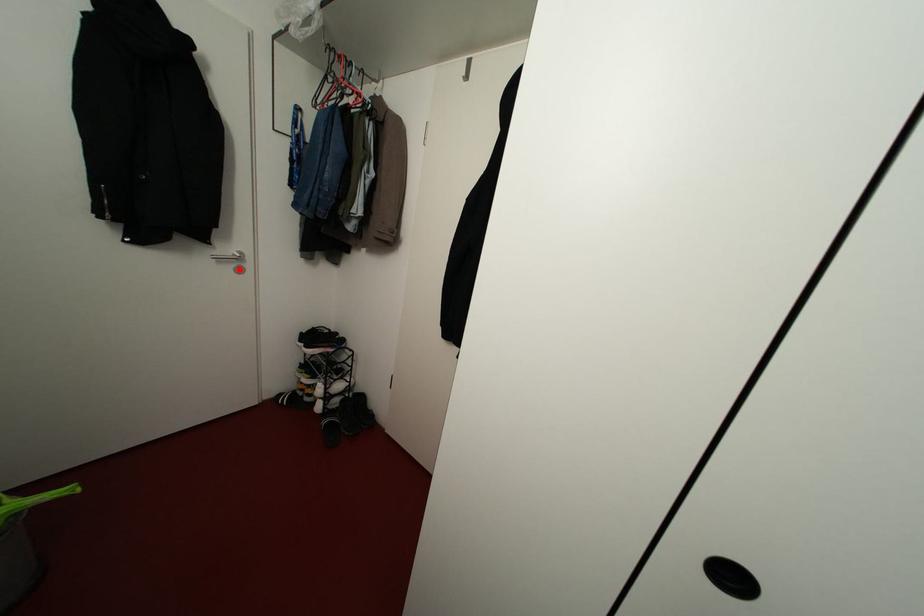
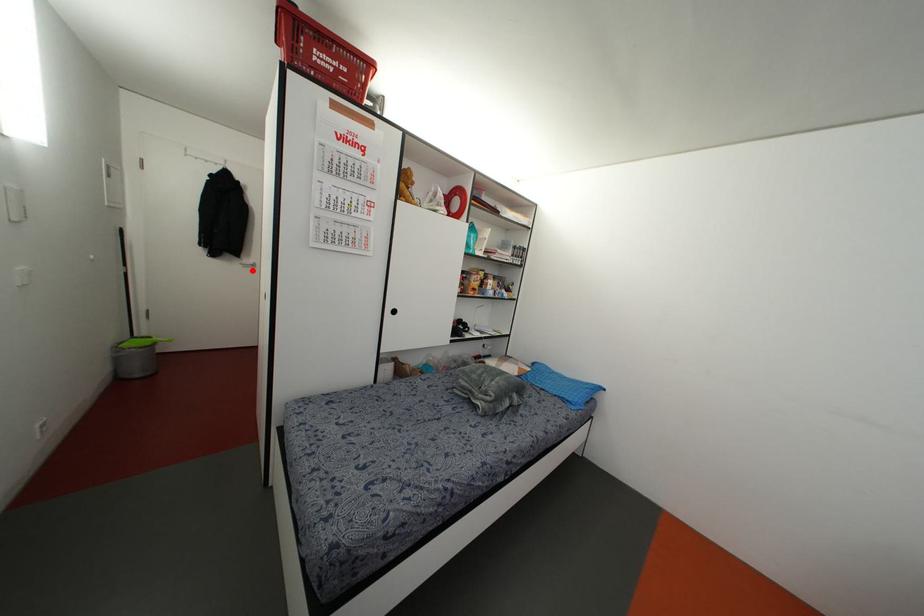
I am providing you with two images of the same scene from different viewpoints. A red point is marked on the first image and another point is marked on the second image. Do the highlighted points in image1 and image2 indicate the same real-world spot?

Yes